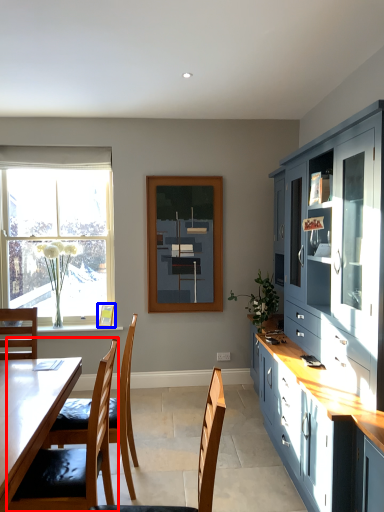
Question: Which of the following is the closest to the observer, chair (highlighted by a red box) or picture frame (highlighted by a blue box)?

Choices:
 (A) chair
 (B) picture frame

Answer: (A)